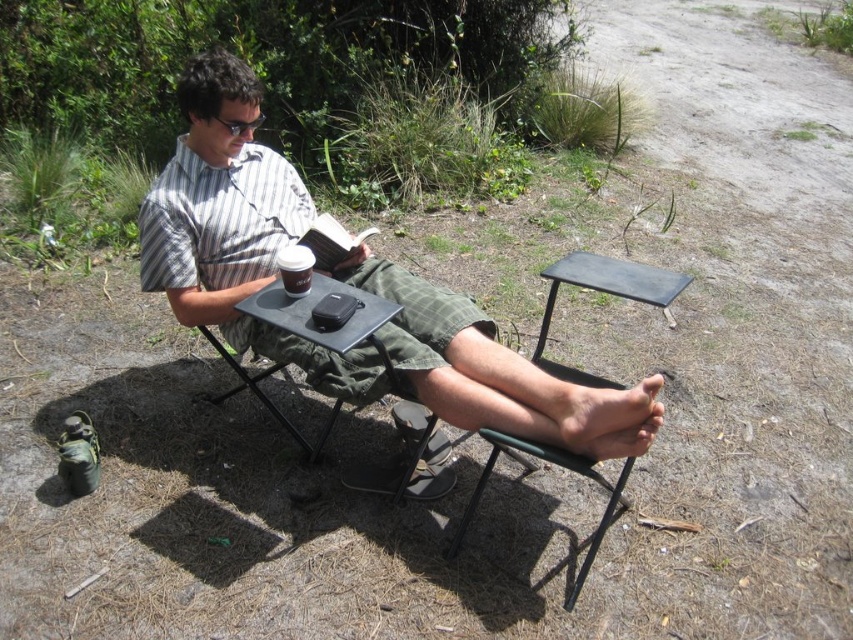
You are a photographer taking a closeup shot of the matte black phone at center and the white paper cup at center. Which object should you focus on first if you want to capture both in the same frame without zooming in?

You should focus on the matte black phone at center first because it is larger than the white paper cup at center, so it will require more attention to detail to fit both in the frame.

You are a photographer trying to capture a closeup of the matte black phone at center and the metallic black chair at lower center in the scene. Since you want both objects to appear similarly sized in the photo, which object should you move closer to the camera?

The matte black phone at center is larger in size than the metallic black chair at lower center. To make them appear similar in size in the photo, you should move the metallic black chair at lower center closer to the camera since it is smaller and needs to be magnified more to match the size of the phone.

Consider the image. You are a photographer taking a picture of the scene. You notice the matte black phone at center and the white paper cup at center. Which object should you focus on first if you want to capture both in the same frame without moving the camera?

You should focus on the white paper cup at center first because the matte black phone at center is located below it, ensuring both will be in the frame if you adjust focus starting from the higher object.